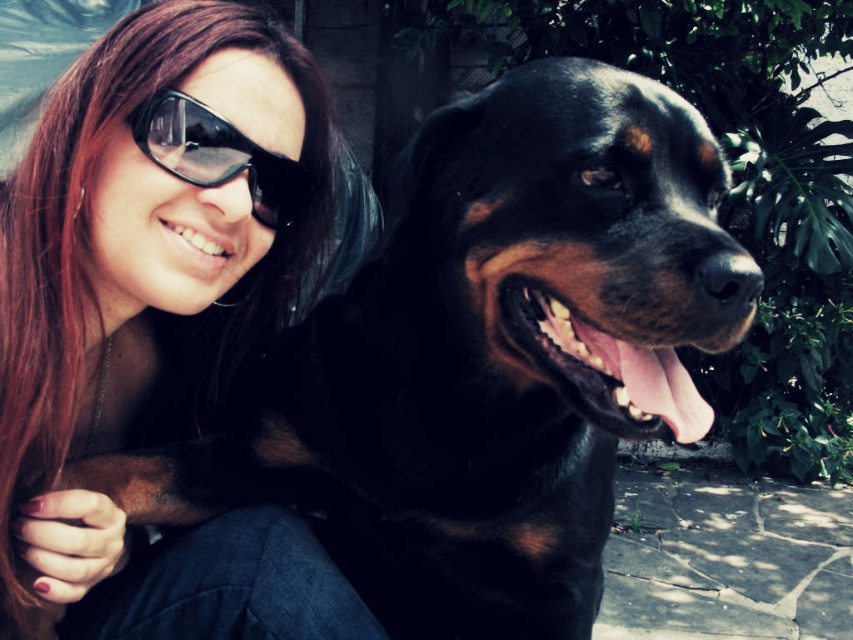
You are a photographer adjusting your camera settings. You notice two objects in the upper left corner of the frame. The matte black hair at upper left and the black plastic goggles at upper left. You want to ensure both are in focus. The depth of field of your current lens setting can cover 6 inches. Will both objects be in focus?

The distance between the matte black hair at upper left and the black plastic goggles at upper left is 6.36 inches. Since the depth of field can only cover 6 inches, the two objects are slightly beyond the coverage, so they might not both be in focus simultaneously.